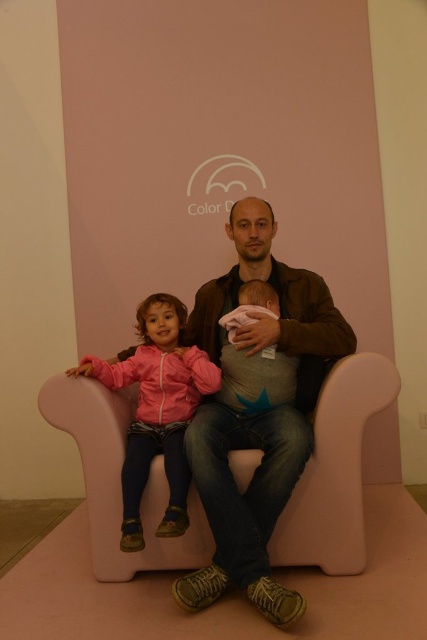
You are a photographer standing in front of the scene. You need to adjust your camera focus to capture both the pink foam armchair at center and the soft pink fabric baby at center clearly. Which object should you focus on first to ensure both are in focus?

You should focus on the pink foam armchair at center first because it is closer to the viewer than the soft pink fabric baby at center. By focusing on the closer object, the depth of field may allow the farther object to also be in focus.

You are a photographer at the Color D event. You need to adjust the lighting so that the pink matte jacket at center and the soft pink fabric baby at center are evenly lit. Which object should you move closer to the light source to achieve this?

The pink matte jacket at center is positioned on the left side of soft pink fabric baby at center. To evenly light both objects, move the pink matte jacket at center closer to the light source since it is farther away from the light compared to the baby.